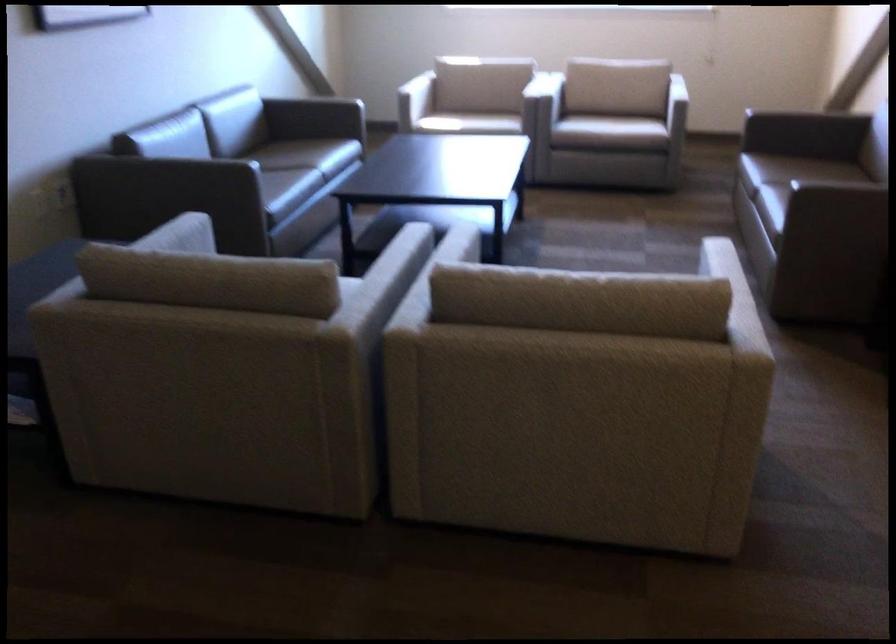
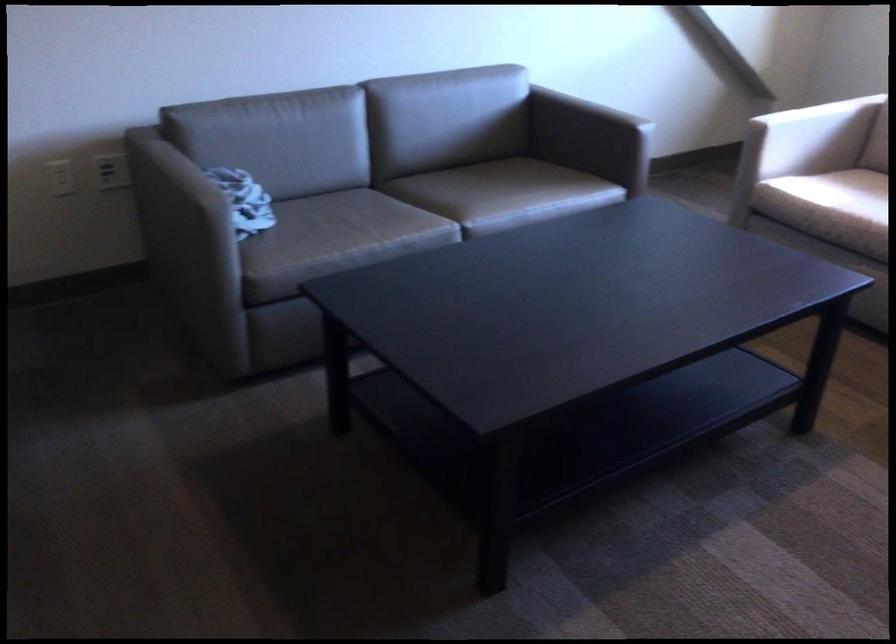
Find the pixel in the second image that matches the point at 448,120 in the first image.

(821, 216)